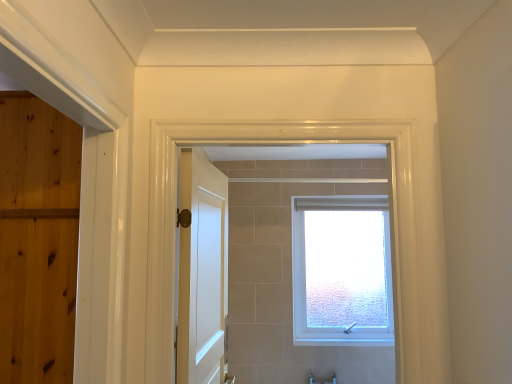
This screenshot has height=384, width=512. Identify the location of white frosted glass window at center. (342, 271).

What is the approximate width of white frosted glass window at center?

white frosted glass window at center is 8.51 inches wide.

Image resolution: width=512 pixels, height=384 pixels. Describe the element at coordinates (342, 271) in the screenshot. I see `white frosted glass window at center` at that location.

At what (x,y) coordinates should I click in order to perform the action: click on white glossy door at center. Please return your answer as a coordinate pair (x, y). Looking at the image, I should click on (202, 272).

Image resolution: width=512 pixels, height=384 pixels. Describe the element at coordinates (202, 272) in the screenshot. I see `white glossy door at center` at that location.

What is the approximate width of white glossy door at center?

14.07 centimeters.

The height and width of the screenshot is (384, 512). Identify the location of white frosted glass window at center. (342, 271).

Considering the positions of objects white frosted glass window at center and white glossy door at center in the image provided, who is more to the right, white frosted glass window at center or white glossy door at center?

white frosted glass window at center.

Is white frosted glass window at center further to camera compared to white glossy door at center?

Yes, white frosted glass window at center is further from the viewer.

Does point (390, 272) lie behind point (185, 299)?

Yes.

From the image's perspective, which object appears higher, white frosted glass window at center or white glossy door at center?

From the image's view, white glossy door at center is above.

From a real-world perspective, is white frosted glass window at center on white glossy door at center?

No.

Does white frosted glass window at center have a lesser width compared to white glossy door at center?

No.

Considering the relative sizes of white frosted glass window at center and white glossy door at center in the image provided, is white frosted glass window at center shorter than white glossy door at center?

In fact, white frosted glass window at center may be taller than white glossy door at center.

Is white frosted glass window at center smaller than white glossy door at center?

No, white frosted glass window at center is not smaller than white glossy door at center.

Is white glossy door at center completely or partially inside white frosted glass window at center?

No, white frosted glass window at center does not contain white glossy door at center.

Based on the photo, is white frosted glass window at center with white glossy door at center?

No, white frosted glass window at center is not beside white glossy door at center.

Could you tell me if white frosted glass window at center is turned towards white glossy door at center?

Yes, white frosted glass window at center is facing white glossy door at center.

What's the angular difference between white frosted glass window at center and white glossy door at center's facing directions?

The facing directions of white frosted glass window at center and white glossy door at center are 83.8 degrees apart.

The width and height of the screenshot is (512, 384). What are the coordinates of `door above the white frosted glass window at center (from a real-world perspective)` in the screenshot? It's located at coord(202,272).

Considering the positions of objects white glossy door at center and white frosted glass window at center in the image provided, who is more to the left, white glossy door at center or white frosted glass window at center?

white glossy door at center is more to the left.

Does white glossy door at center come behind white frosted glass window at center?

No.

Which is nearer, (213, 240) or (336, 307)?

Point (213, 240).

From the image's perspective, does white glossy door at center appear higher than white frosted glass window at center?

Yes.

From a real-world perspective, relative to white frosted glass window at center, is white glossy door at center vertically above or below?

white glossy door at center is above white frosted glass window at center.

Which of these two, white glossy door at center or white frosted glass window at center, is thinner?

Thinner between the two is white glossy door at center.

In terms of height, does white glossy door at center look taller or shorter compared to white frosted glass window at center?

Clearly, white glossy door at center is shorter compared to white frosted glass window at center.

Who is bigger, white glossy door at center or white frosted glass window at center?

white frosted glass window at center.

Consider the image. Does white glossy door at center contain white frosted glass window at center?

No, white frosted glass window at center is not a part of white glossy door at center.

Is white glossy door at center with white frosted glass window at center?

No, white glossy door at center is not next to white frosted glass window at center.

Looking at this image, is white glossy door at center aimed at white frosted glass window at center?

No, white glossy door at center does not turn towards white frosted glass window at center.

Consider the image. How different are the orientations of white glossy door at center and white frosted glass window at center in degrees?

The facing directions of white glossy door at center and white frosted glass window at center are 83.8 degrees apart.

How distant is white glossy door at center from white frosted glass window at center?

They are 1.64 meters apart.

This screenshot has height=384, width=512. I want to click on window that is on the right side of white glossy door at center, so click(342, 271).

This screenshot has height=384, width=512. Identify the location of window to the right of white glossy door at center. (342, 271).

Locate an element on the screen. This screenshot has width=512, height=384. door in front of the white frosted glass window at center is located at coordinates (202, 272).